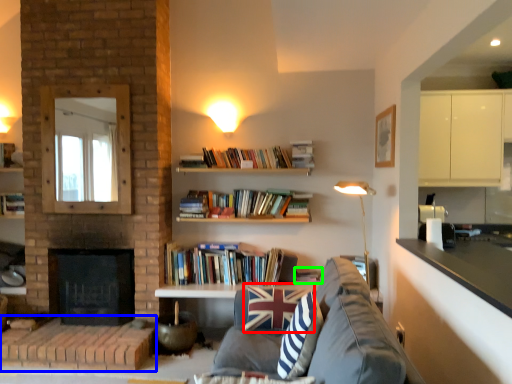
Question: Considering the real-world distances, which object is farthest from pillow (highlighted by a red box)? brickwork (highlighted by a blue box) or book (highlighted by a green box)?

Choices:
 (A) brickwork
 (B) book

Answer: (A)